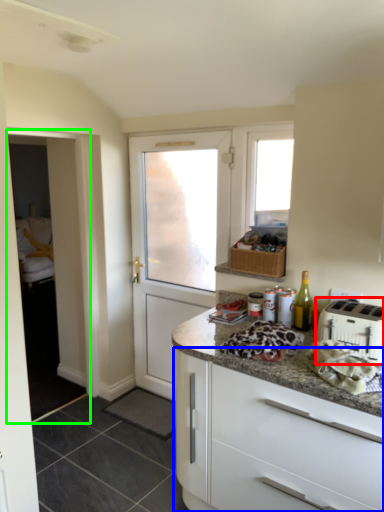
Question: Estimate the real-world distances between objects in this image. Which object is closer to toaster (highlighted by a red box), cabinetry (highlighted by a blue box) or screen door (highlighted by a green box)?

Choices:
 (A) cabinetry
 (B) screen door

Answer: (A)